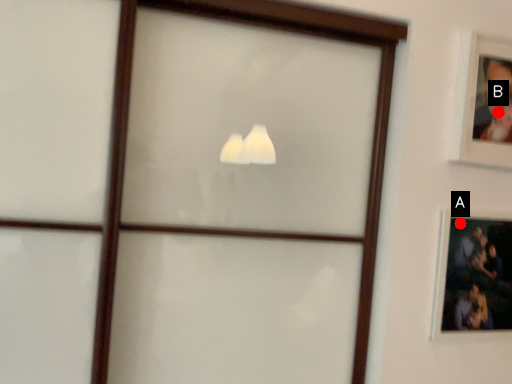
Question: Two points are circled on the image, labeled by A and B beside each circle. Which of the following is the closest to the observer?

Choices:
 (A) A is closer
 (B) B is closer

Answer: (B)